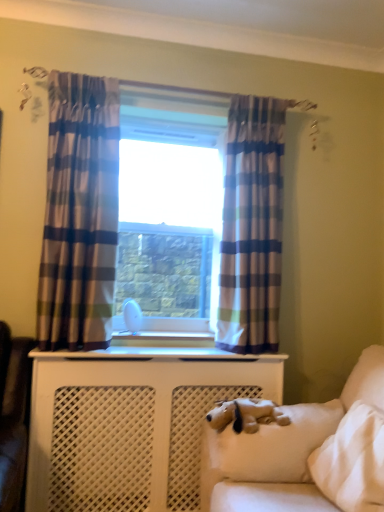
Looking at this image, what is the approximate height of white plush dog at lower right?

22.91 inches.

The width and height of the screenshot is (384, 512). What do you see at coordinates (282, 450) in the screenshot?
I see `white plush dog at lower right` at bounding box center [282, 450].

Describe the element at coordinates (79, 214) in the screenshot. I see `plaid fabric curtain at left, the first curtain positioned from the left` at that location.

What do you see at coordinates (165, 335) in the screenshot? The width and height of the screenshot is (384, 512). I see `white glossy radiator at center` at bounding box center [165, 335].

Locate an element on the screen. The height and width of the screenshot is (512, 384). white glossy radiator at center is located at coordinates (165, 335).

You are a GUI agent. You are given a task and a screenshot of the screen. Output one action in this format:
    pyautogui.click(x=<x>, y=<y>)
    Task: Click on the white plush dog at lower right
    The image size is (384, 512).
    Given the screenshot: What is the action you would take?
    pyautogui.click(x=282, y=450)

Considering the relative sizes of brown plush dog at lower right and plaid fabric curtain at left, the first curtain positioned from the left, in the image provided, is brown plush dog at lower right bigger than plaid fabric curtain at left, the first curtain positioned from the left,?

No.

Between brown plush dog at lower right and plaid fabric curtain at left, which ranks as the 2th curtain in right-to-left order, which one has smaller width?

plaid fabric curtain at left, which ranks as the 2th curtain in right-to-left order.

Looking at this image, what's the angular difference between brown plush dog at lower right and plaid fabric curtain at left, which ranks as the 2th curtain in right-to-left order,'s facing directions?

They differ by 88.9 degrees in their facing directions.

Could you measure the distance between brown plush dog at lower right and plaid fabric curtain at left, which ranks as the 2th curtain in right-to-left order?

Result: A distance of 37.63 inches exists between brown plush dog at lower right and plaid fabric curtain at left, which ranks as the 2th curtain in right-to-left order.

Between clear glass window at center and white glossy radiator at center, which one appears on the left side from the viewer's perspective?

white glossy radiator at center.

Between point (145, 188) and point (179, 330), which one is positioned behind?

The point (145, 188) is farther from the camera.

Which of these two, clear glass window at center or white glossy radiator at center, stands taller?

clear glass window at center.

In the scene shown: Is brown plush dog at lower right taller or shorter than clear glass window at center?

brown plush dog at lower right is shorter than clear glass window at center.

How different are the orientations of brown plush dog at lower right and clear glass window at center in degrees?

brown plush dog at lower right and clear glass window at center are facing 87.6 degrees away from each other.

From the image's perspective, is brown plush dog at lower right located above clear glass window at center?

Incorrect, from the image's perspective, brown plush dog at lower right is lower than clear glass window at center.

Do you think brown plush dog at lower right is within clear glass window at center, or outside of it?

brown plush dog at lower right is not inside clear glass window at center, it's outside.

Would you say white glossy radiator at center is to the left or to the right of white plush dog at lower right in the picture?

From the image, it's evident that white glossy radiator at center is to the left of white plush dog at lower right.

In terms of height, does white glossy radiator at center look taller or shorter compared to white plush dog at lower right?

Clearly, white glossy radiator at center is shorter compared to white plush dog at lower right.

Would you consider white glossy radiator at center to be distant from white plush dog at lower right?

That's not correct — white glossy radiator at center is a little close to white plush dog at lower right.

Consider the image. From a real-world perspective, who is located lower, blue plaid curtain at center, which ranks as the 2th curtain in left-to-right order, or white plush dog at lower right?

white plush dog at lower right, from a real-world perspective.

Is point (277, 339) less distant than point (247, 471)?

No, it is not.

Can you confirm if blue plaid curtain at center, which ranks as the 2th curtain in left-to-right order, is thinner than white plush dog at lower right?

Yes.

Is blue plaid curtain at center, the 1th curtain in the right-to-left sequence, to the left of white plush dog at lower right from the viewer's perspective?

Yes.

Between plaid fabric curtain at left, which ranks as the 2th curtain in right-to-left order, and blue plaid curtain at center, which ranks as the 2th curtain in left-to-right order, which one has smaller size?

Smaller between the two is blue plaid curtain at center, which ranks as the 2th curtain in left-to-right order.

Is blue plaid curtain at center, which ranks as the 2th curtain in left-to-right order, located within plaid fabric curtain at left, the first curtain positioned from the left?

No, blue plaid curtain at center, which ranks as the 2th curtain in left-to-right order, is not inside plaid fabric curtain at left, the first curtain positioned from the left.

Is plaid fabric curtain at left, which ranks as the 2th curtain in right-to-left order, not close to blue plaid curtain at center, which ranks as the 2th curtain in left-to-right order?

Actually, plaid fabric curtain at left, which ranks as the 2th curtain in right-to-left order, and blue plaid curtain at center, which ranks as the 2th curtain in left-to-right order, are a little close together.

Which is in front, plaid fabric curtain at left, which ranks as the 2th curtain in right-to-left order, or brown plush dog at lower right?

brown plush dog at lower right is more forward.

Is point (53, 109) farther from camera compared to point (287, 416)?

Yes, point (53, 109) is behind point (287, 416).

Locate an element on the screen. The width and height of the screenshot is (384, 512). animal in front of the plaid fabric curtain at left, the first curtain positioned from the left is located at coordinates (246, 415).

Identify the location of the 2nd curtain located above the brown plush dog at lower right (from a real-world perspective). Image resolution: width=384 pixels, height=512 pixels. (79, 214).

Where is `window sill that is on the left side of clear glass window at center`? window sill that is on the left side of clear glass window at center is located at coordinates (165, 335).

Based on their spatial positions, is white glossy radiator at center or white soft pillow at lower right further from brown plush dog at lower right?

white glossy radiator at center lies further to brown plush dog at lower right than the other object.

Looking at the image, which one is located closer to clear glass window at center, blue plaid curtain at center, which ranks as the 2th curtain in left-to-right order, or white plush dog at lower right?

blue plaid curtain at center, which ranks as the 2th curtain in left-to-right order, is positioned closer to the anchor clear glass window at center.

In the scene shown: Based on their spatial positions, is brown plush dog at lower right or white plush dog at lower right further from clear glass window at center?

white plush dog at lower right is positioned further to the anchor clear glass window at center.

When comparing their distances from clear glass window at center, does brown plush dog at lower right or white soft pillow at lower right seem further?

white soft pillow at lower right.

Considering their positions, is plaid fabric curtain at left, the first curtain positioned from the left, positioned further to white soft pillow at lower right than blue plaid curtain at center, the 1th curtain in the right-to-left sequence?

Based on the image, plaid fabric curtain at left, the first curtain positioned from the left, appears to be further to white soft pillow at lower right.

Based on their spatial positions, is clear glass window at center or white plush dog at lower right closer to white glossy radiator at center?

clear glass window at center is closer to white glossy radiator at center.

Looking at this image, which object lies further to the anchor point plaid fabric curtain at left, the first curtain positioned from the left, brown plush dog at lower right or blue plaid curtain at center, which ranks as the 2th curtain in left-to-right order?

Based on the image, brown plush dog at lower right appears to be further to plaid fabric curtain at left, the first curtain positioned from the left.

From the image, which object appears to be farther from white plush dog at lower right, brown plush dog at lower right or white soft pillow at lower right?

Based on the image, brown plush dog at lower right appears to be further to white plush dog at lower right.

At what (x,y) coordinates should I click in order to perform the action: click on curtain between clear glass window at center and white soft pillow at lower right in the vertical direction. Please return your answer as a coordinate pair (x, y). This screenshot has width=384, height=512. Looking at the image, I should click on click(252, 226).

Locate an element on the screen. The width and height of the screenshot is (384, 512). animal between blue plaid curtain at center, which ranks as the 2th curtain in left-to-right order, and white plush dog at lower right, in the vertical direction is located at coordinates [246, 415].

Locate an element on the screen. window between plaid fabric curtain at left, which ranks as the 2th curtain in right-to-left order, and white plush dog at lower right, in the vertical direction is located at coordinates (171, 213).

Locate an element on the screen. animal between white glossy radiator at center and white soft pillow at lower right in the horizontal direction is located at coordinates pyautogui.click(x=246, y=415).